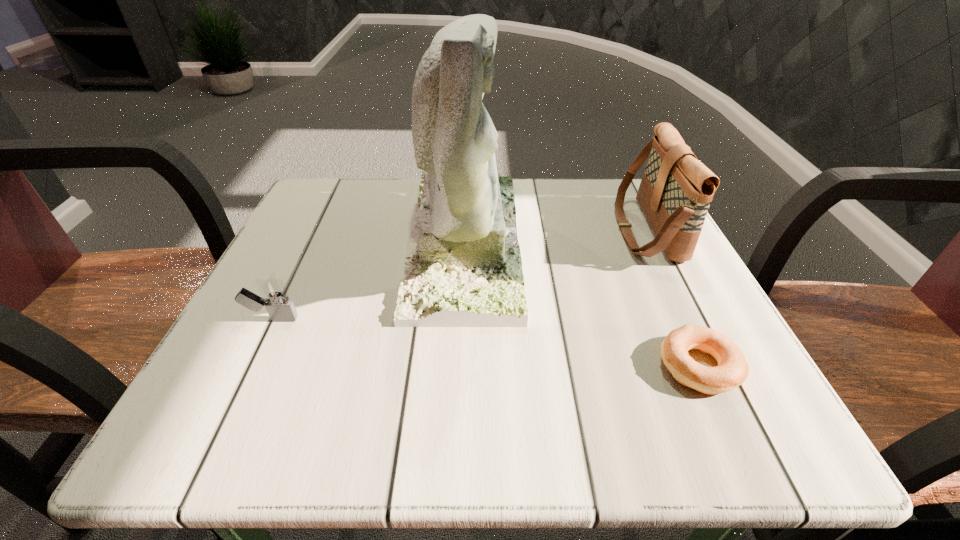
This screenshot has width=960, height=540. Identify the location of free space that satisfies the following two spatial constraints: 1. on the front-facing side of the shoulder bag; 2. on the front side of the bagel. (712, 366).

You are a GUI agent. You are given a task and a screenshot of the screen. Output one action in this format:
    pyautogui.click(x=<x>, y=<y>)
    Task: Click on the vacant area in the image that satisfies the following two spatial constraints: 1. on the front-facing side of the shoulder bag; 2. on the front side of the second shortest object
    The width and height of the screenshot is (960, 540).
    Given the screenshot: What is the action you would take?
    pyautogui.click(x=689, y=319)